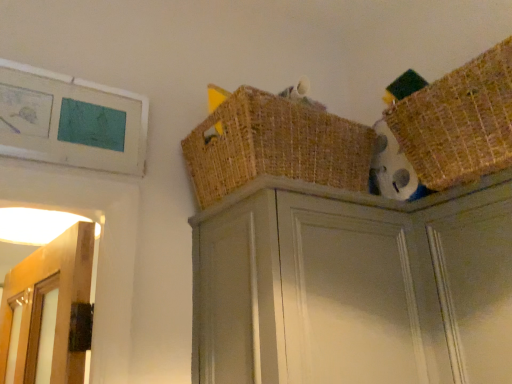
Question: From the image's perspective, does matte gray cabinet at upper center appear higher than woven brown basket at upper right, which is counted as the 1th basket, starting from the right?

Choices:
 (A) no
 (B) yes

Answer: (A)

Question: Can you confirm if matte gray cabinet at upper center is wider than woven brown basket at upper right, which is counted as the 1th basket, starting from the right?

Choices:
 (A) no
 (B) yes

Answer: (B)

Question: From the image's perspective, is matte gray cabinet at upper center located beneath woven brown basket at upper right, which is counted as the 1th basket, starting from the right?

Choices:
 (A) no
 (B) yes

Answer: (B)

Question: Considering the relative sizes of matte gray cabinet at upper center and woven brown basket at upper right, which appears as the 2th basket when viewed from the left, in the image provided, is matte gray cabinet at upper center smaller than woven brown basket at upper right, which appears as the 2th basket when viewed from the left,?

Choices:
 (A) yes
 (B) no

Answer: (B)

Question: Is matte gray cabinet at upper center facing towards woven brown basket at upper right, which is counted as the 1th basket, starting from the right?

Choices:
 (A) no
 (B) yes

Answer: (A)

Question: From the image's perspective, is woven brown basket at upper center, the second basket viewed from the right, above or below woven brown basket at upper right, which appears as the 2th basket when viewed from the left?

Choices:
 (A) below
 (B) above

Answer: (A)

Question: In the image, is woven brown basket at upper center, the second basket viewed from the right, positioned in front of or behind woven brown basket at upper right, which appears as the 2th basket when viewed from the left?

Choices:
 (A) behind
 (B) front

Answer: (A)

Question: Visually, is woven brown basket at upper center, the second basket viewed from the right, positioned to the left or to the right of woven brown basket at upper right, which appears as the 2th basket when viewed from the left?

Choices:
 (A) left
 (B) right

Answer: (A)

Question: Considering the positions of point (311, 117) and point (457, 97), is point (311, 117) closer or farther from the camera than point (457, 97)?

Choices:
 (A) closer
 (B) farther

Answer: (B)

Question: Considering the positions of matte gray cabinet at upper center and woven brown basket at upper right, which appears as the 2th basket when viewed from the left, in the image, is matte gray cabinet at upper center wider or thinner than woven brown basket at upper right, which appears as the 2th basket when viewed from the left,?

Choices:
 (A) wide
 (B) thin

Answer: (A)

Question: From the image's perspective, is matte gray cabinet at upper center positioned above or below woven brown basket at upper right, which is counted as the 1th basket, starting from the right?

Choices:
 (A) above
 (B) below

Answer: (B)

Question: Considering the relative positions of matte gray cabinet at upper center and woven brown basket at upper right, which is counted as the 1th basket, starting from the right, in the image provided, is matte gray cabinet at upper center to the left or to the right of woven brown basket at upper right, which is counted as the 1th basket, starting from the right,?

Choices:
 (A) left
 (B) right

Answer: (A)

Question: Which is correct: matte gray cabinet at upper center is inside woven brown basket at upper right, which appears as the 2th basket when viewed from the left, or outside of it?

Choices:
 (A) inside
 (B) outside

Answer: (B)

Question: From a real-world perspective, relative to matte gray cabinet at upper center, is woven brown basket at upper right, which appears as the 2th basket when viewed from the left, vertically above or below?

Choices:
 (A) above
 (B) below

Answer: (A)

Question: Considering the positions of woven brown basket at upper right, which appears as the 2th basket when viewed from the left, and matte gray cabinet at upper center in the image, is woven brown basket at upper right, which appears as the 2th basket when viewed from the left, taller or shorter than matte gray cabinet at upper center?

Choices:
 (A) short
 (B) tall

Answer: (A)